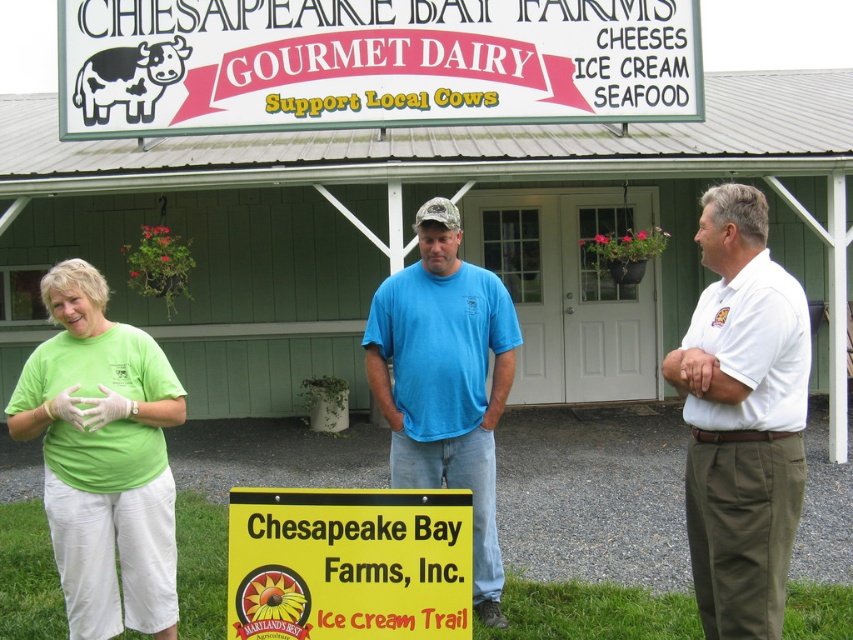
You are a visitor at Chesapeake Bay Farms, Inc. and see two signs, the white plastic sign at upper center and the yellow plastic sign at center. Which sign is located to the left of the other?

The white plastic sign at upper center is positioned on the left side of yellow plastic sign at center.